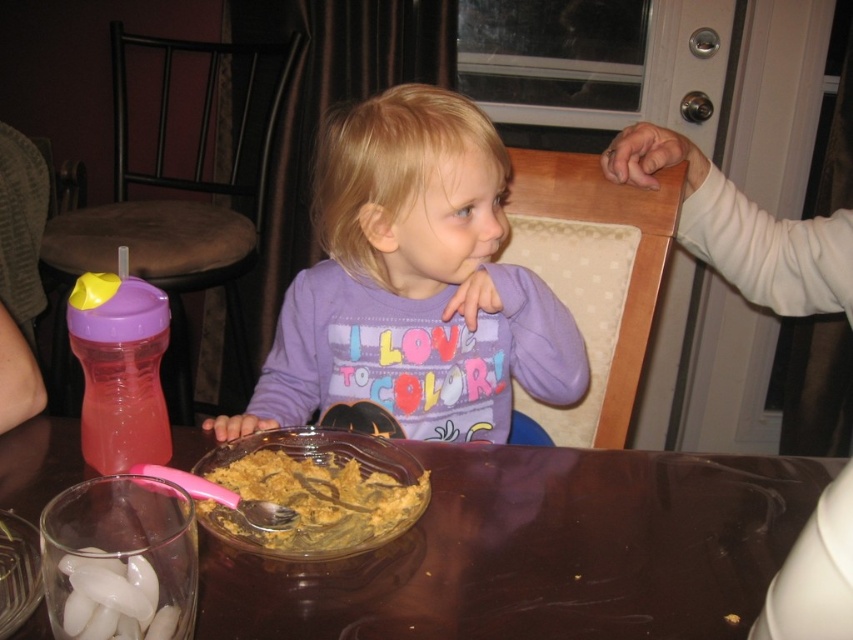
Does point (410, 332) come in front of point (120, 627)?

No, (410, 332) is behind (120, 627).

This screenshot has width=853, height=640. What are the coordinates of `purple soft cotton shirt at center` in the screenshot? It's located at (415, 284).

Who is more distant from viewer, [335,529] or [106,564]?

The point [335,529] is more distant.

Is brown crumbly food at center thinner than white rubber teether at lower left?

Incorrect, brown crumbly food at center's width is not less than white rubber teether at lower left's.

Between point (364, 456) and point (74, 625), which one is positioned in front?

Positioned in front is point (74, 625).

Where is `brown crumbly food at center`? The width and height of the screenshot is (853, 640). brown crumbly food at center is located at coordinates (316, 492).

Is point (521, 621) closer to viewer compared to point (102, 612)?

No, (521, 621) is further to viewer.

The image size is (853, 640). I want to click on transparent glass bowl at center, so pyautogui.click(x=540, y=552).